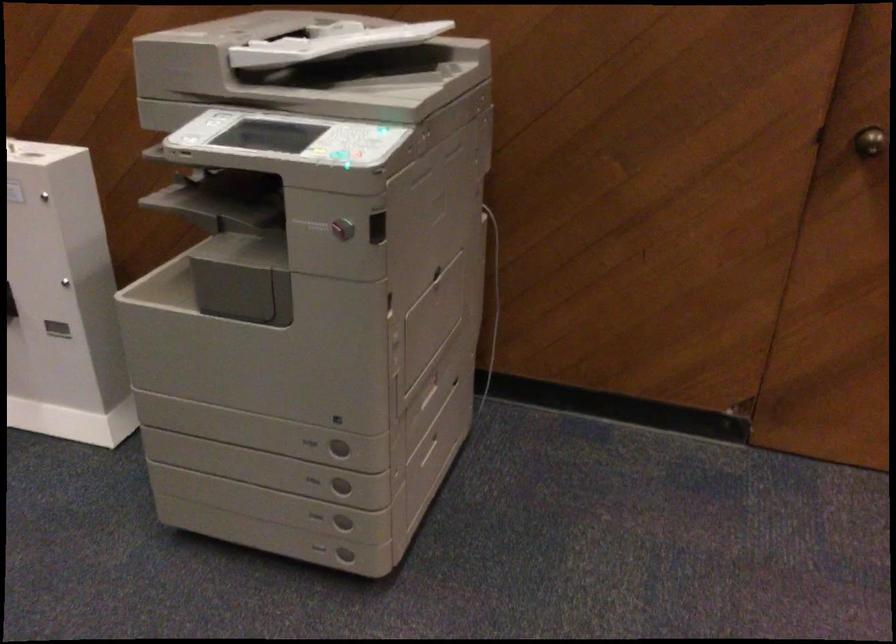
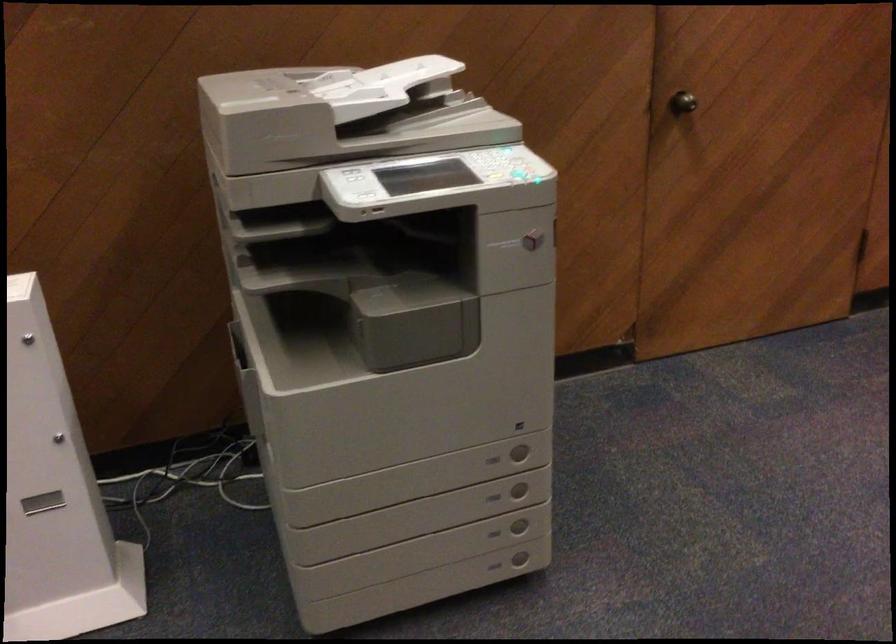
Where in the second image is the point corresponding to [234,125] from the first image?

(354, 175)